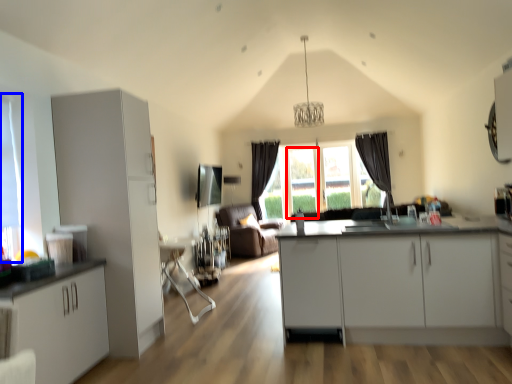
Question: Which object appears farthest to the camera in this image, glass door (highlighted by a red box) or window (highlighted by a blue box)?

Choices:
 (A) glass door
 (B) window

Answer: (A)